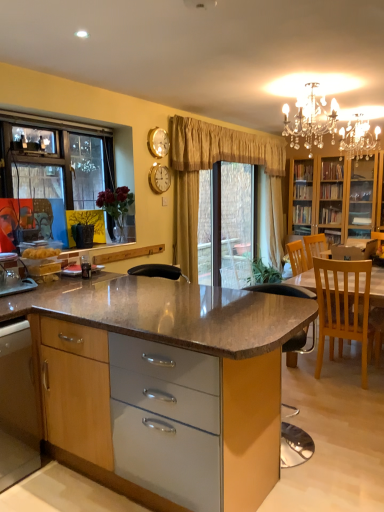
Question: From the image's perspective, does wooden cabinet at lower left, the 2th cabinetry from the right, appear higher than light wood chair at right?

Choices:
 (A) no
 (B) yes

Answer: (A)

Question: Is wooden cabinet at lower left, acting as the 1th cabinetry starting from the left, smaller than light wood chair at right?

Choices:
 (A) yes
 (B) no

Answer: (A)

Question: Is wooden cabinet at lower left, the 2th cabinetry from the right, further to the viewer compared to light wood chair at right?

Choices:
 (A) yes
 (B) no

Answer: (B)

Question: Is wooden cabinet at lower left, the 2th cabinetry from the right, not within light wood chair at right?

Choices:
 (A) yes
 (B) no

Answer: (A)

Question: From the image's perspective, is wooden cabinet at lower left, the 2th cabinetry from the right, located beneath light wood chair at right?

Choices:
 (A) no
 (B) yes

Answer: (B)

Question: From a real-world perspective, relative to beige fabric curtain at center, is wooden/textured cabinet at center, the first cabinetry from the right, vertically above or below?

Choices:
 (A) below
 (B) above

Answer: (A)

Question: Considering their positions, is wooden/textured cabinet at center, positioned as the 2th cabinetry in left-to-right order, located in front of or behind beige fabric curtain at center?

Choices:
 (A) behind
 (B) front

Answer: (B)

Question: Based on their sizes in the image, would you say wooden/textured cabinet at center, positioned as the 2th cabinetry in left-to-right order, is bigger or smaller than beige fabric curtain at center?

Choices:
 (A) big
 (B) small

Answer: (A)

Question: Does point (200, 436) appear closer or farther from the camera than point (273, 214)?

Choices:
 (A) closer
 (B) farther

Answer: (A)

Question: In terms of height, does light wood chair at right look taller or shorter compared to gold metallic clock at upper center?

Choices:
 (A) short
 (B) tall

Answer: (B)

Question: Is light wood chair at right spatially inside gold metallic clock at upper center, or outside of it?

Choices:
 (A) inside
 (B) outside

Answer: (B)

Question: In the image, is light wood chair at right positioned in front of or behind gold metallic clock at upper center?

Choices:
 (A) front
 (B) behind

Answer: (A)

Question: Looking at the image, does light wood chair at right seem bigger or smaller compared to gold metallic clock at upper center?

Choices:
 (A) small
 (B) big

Answer: (B)

Question: From the image's perspective, is wooden/textured cabinet at center, positioned as the 2th cabinetry in left-to-right order, located above or below clear plastic window screen at center?

Choices:
 (A) below
 (B) above

Answer: (A)

Question: Is wooden/textured cabinet at center, positioned as the 2th cabinetry in left-to-right order, wider or thinner than clear plastic window screen at center?

Choices:
 (A) thin
 (B) wide

Answer: (B)